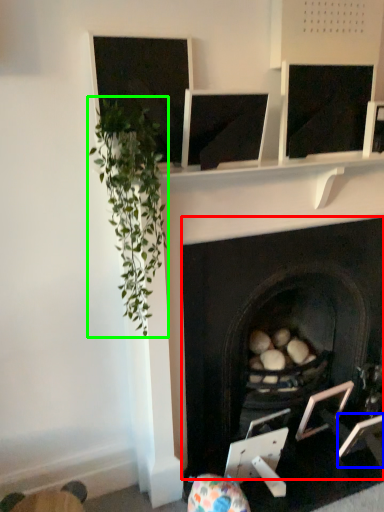
Question: Which is farther away from fireplace (highlighted by a red box)? picture frame (highlighted by a blue box) or plant (highlighted by a green box)?

Choices:
 (A) picture frame
 (B) plant

Answer: (A)